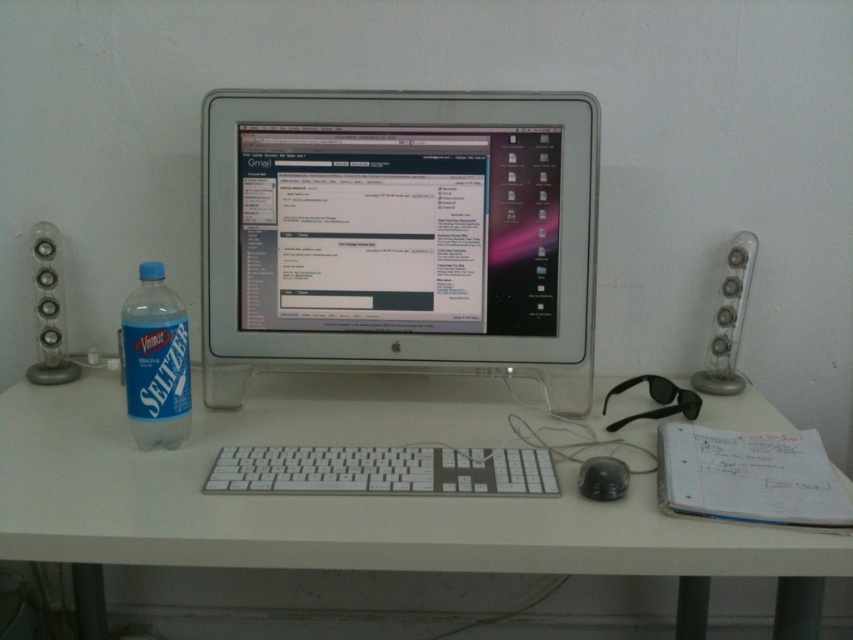
Question: Where is white plastic computer desk at center located in relation to blue plastic bottle at left in the image?

Choices:
 (A) left
 (B) right

Answer: (B)

Question: Based on their relative distances, which object is farther from the white plastic computer desk at center?

Choices:
 (A) silver metallic speaker at right
 (B) sleek silver monitor at center
 (C) clear plastic speaker at left

Answer: (A)

Question: Does white plastic computer desk at center appear under black matte mouse at lower center?

Choices:
 (A) no
 (B) yes

Answer: (B)

Question: Which object is positioned farthest from the black matte mouse at lower center?

Choices:
 (A) white plastic keyboard at center
 (B) blue plastic bottle at left
 (C) clear plastic speaker at left
 (D) silver metallic speaker at right

Answer: (C)

Question: Which point is closer to the camera taking this photo?

Choices:
 (A) (529, 362)
 (B) (53, 289)
 (C) (144, 429)
 (D) (25, 392)

Answer: (C)

Question: Does white plastic computer desk at center have a smaller size compared to black matte mouse at lower center?

Choices:
 (A) yes
 (B) no

Answer: (B)